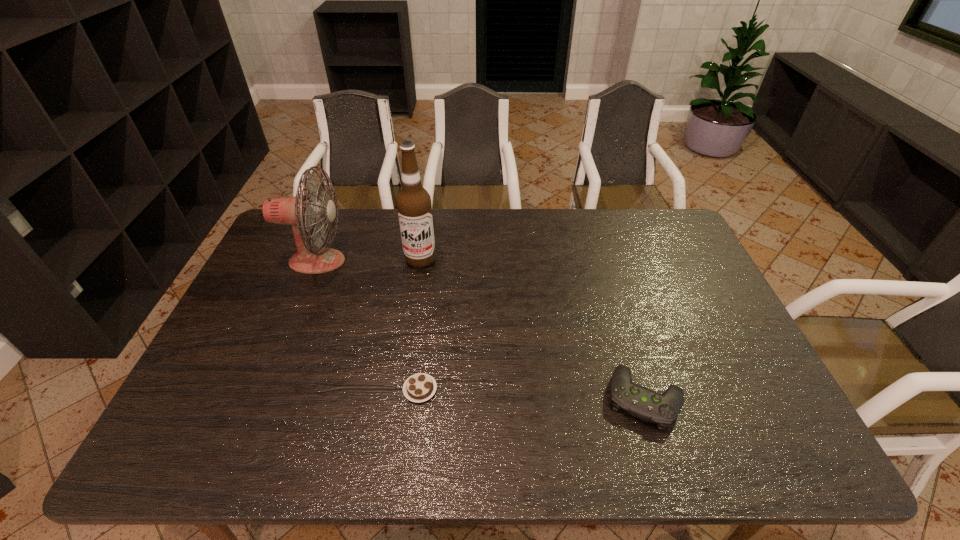
Where is `free space between the second tallest object and the tallest object`? This screenshot has height=540, width=960. free space between the second tallest object and the tallest object is located at coordinates [369, 260].

At what (x,y) coordinates should I click in order to perform the action: click on unoccupied position between the fan and the chocolate cake. Please return your answer as a coordinate pair (x, y). The width and height of the screenshot is (960, 540). Looking at the image, I should click on pos(369,325).

Where is `free space between the chocolate cake and the fan`? The width and height of the screenshot is (960, 540). free space between the chocolate cake and the fan is located at coordinates (369, 325).

This screenshot has height=540, width=960. I want to click on empty space that is in between the alcohol and the rightmost object, so click(533, 329).

Find the location of a particular element. Image resolution: width=960 pixels, height=540 pixels. free space that is in between the chocolate cake and the alcohol is located at coordinates (420, 324).

Find the location of `unoccupied area between the chocolate cake and the fan`. unoccupied area between the chocolate cake and the fan is located at coordinates (369, 325).

Locate an element on the screen. This screenshot has height=540, width=960. vacant area that lies between the tallest object and the leftmost object is located at coordinates (369, 260).

This screenshot has height=540, width=960. Identify the location of vacant area that lies between the alcohol and the second tallest object. (369, 260).

Identify the location of free space between the leftmost object and the alcohol. This screenshot has width=960, height=540. (369, 260).

Find the location of a particular element. The image size is (960, 540). free space between the leftmost object and the chocolate cake is located at coordinates [369, 325].